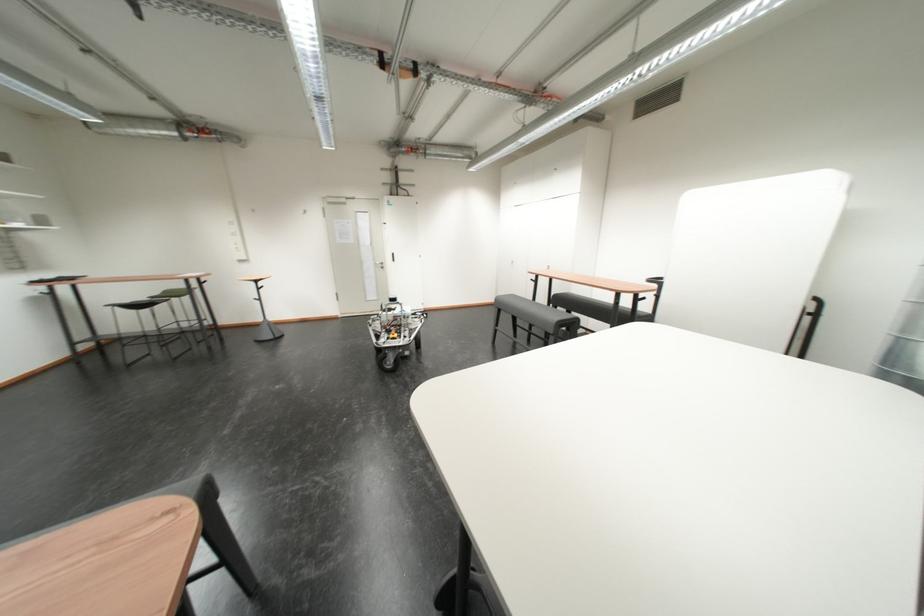
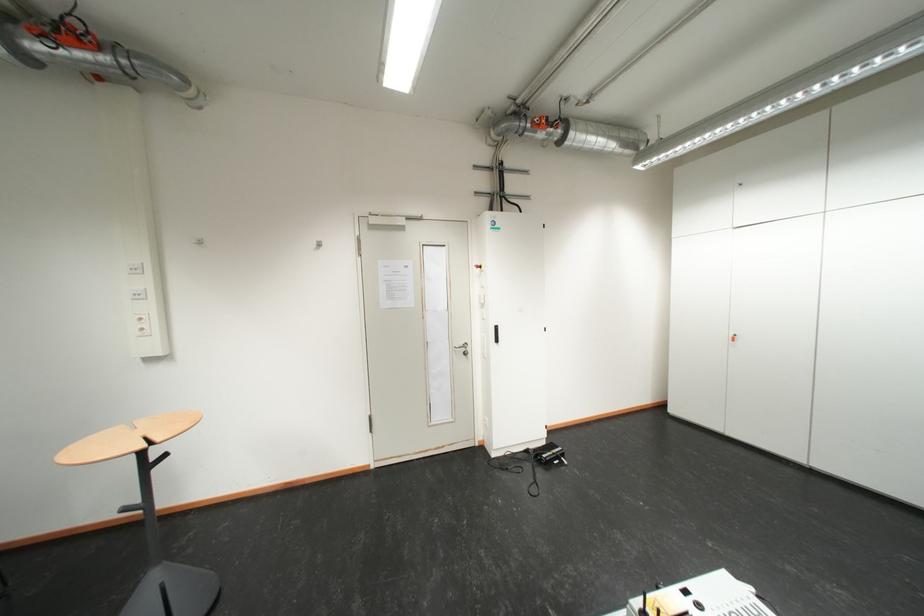
Find the pixel in the second image that matches the point at 405,256 in the first image.

(507, 330)